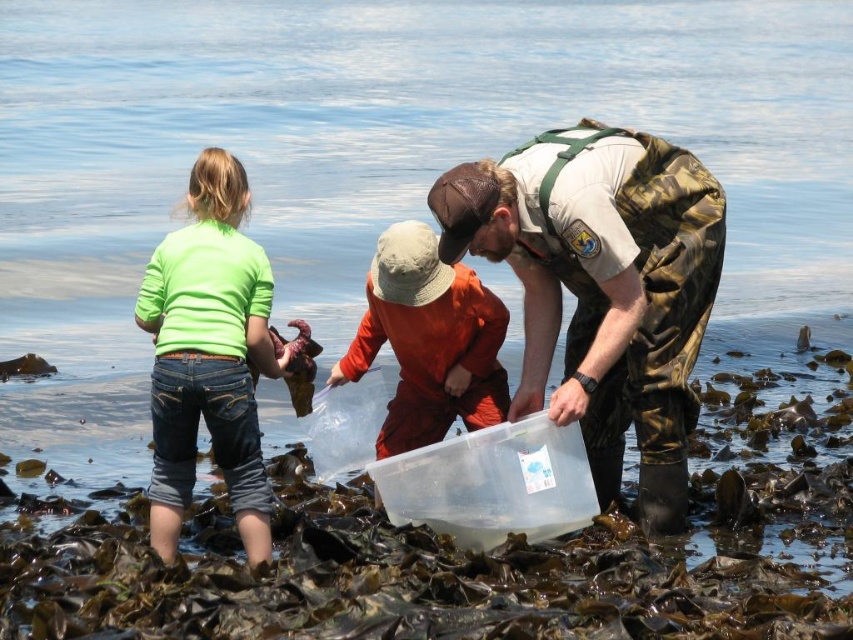
Is green matte shirt at left positioned before orange cotton shirt at center?

Yes, it is.

Identify the location of green matte shirt at left. (207, 355).

Image resolution: width=853 pixels, height=640 pixels. I want to click on green matte shirt at left, so click(207, 355).

Is camouflage pants at center bigger than green matte shirt at left?

Indeed, camouflage pants at center has a larger size compared to green matte shirt at left.

Between camouflage pants at center and green matte shirt at left, which one is positioned higher?

Positioned higher is camouflage pants at center.

Image resolution: width=853 pixels, height=640 pixels. Describe the element at coordinates (602, 288) in the screenshot. I see `camouflage pants at center` at that location.

Locate an element on the screen. camouflage pants at center is located at coordinates (602, 288).

Does point (670, 458) come in front of point (415, 355)?

Yes, point (670, 458) is in front of point (415, 355).

Image resolution: width=853 pixels, height=640 pixels. Identify the location of camouflage pants at center. (602, 288).